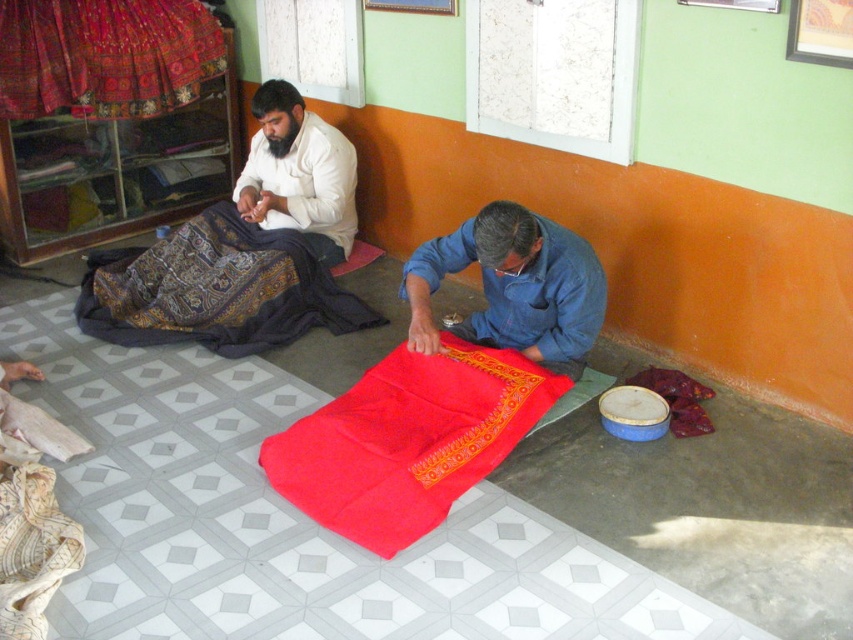
Question: Which object appears closest to the camera in this image?

Choices:
 (A) patterned silk cloth at left
 (B) white cotton shirt at upper left
 (C) embroidered silk cloth at upper left
 (D) denim shirt at lower center

Answer: (D)

Question: Which object is the closest to the denim shirt at lower center?

Choices:
 (A) patterned silk cloth at left
 (B) white cotton shirt at upper left
 (C) matte red fabric at center

Answer: (C)

Question: Based on their relative distances, which object is nearer to the embroidered silk cloth at upper left?

Choices:
 (A) patterned silk cloth at left
 (B) denim shirt at lower center
 (C) matte red fabric at center

Answer: (A)

Question: Is the position of matte red fabric at center more distant than that of denim shirt at lower center?

Choices:
 (A) yes
 (B) no

Answer: (B)

Question: From the image, what is the correct spatial relationship of matte red fabric at center in relation to patterned silk cloth at left?

Choices:
 (A) below
 (B) above

Answer: (A)

Question: Is matte red fabric at center thinner than embroidered silk cloth at upper left?

Choices:
 (A) yes
 (B) no

Answer: (B)